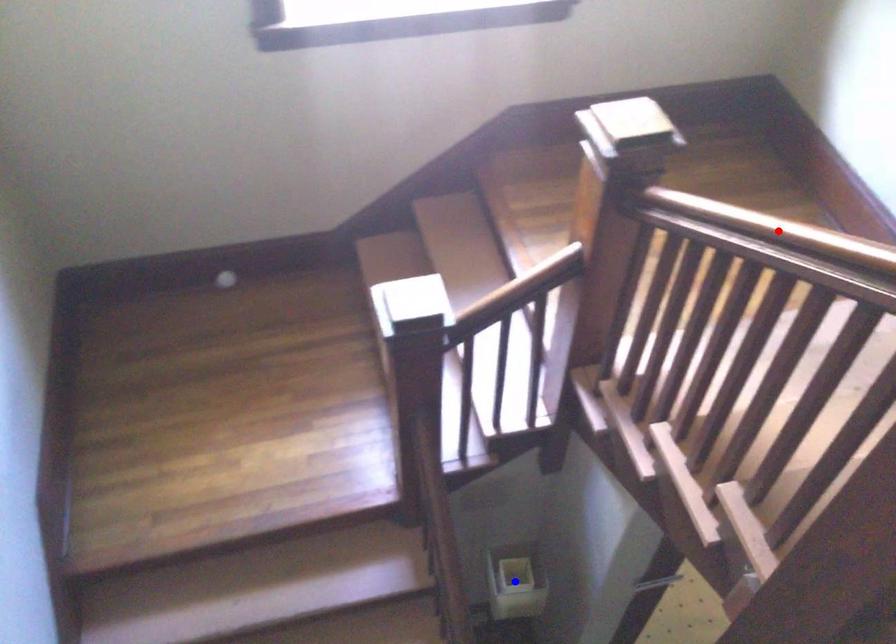
Question: Two points are marked on the image. Which point is closer to the camera?

Choices:
 (A) Blue point is closer.
 (B) Red point is closer.

Answer: (B)